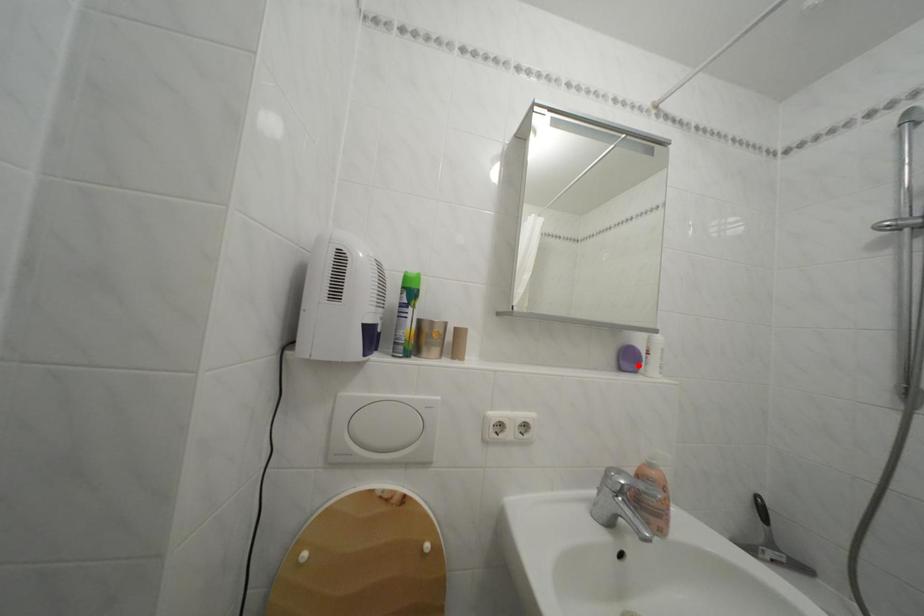
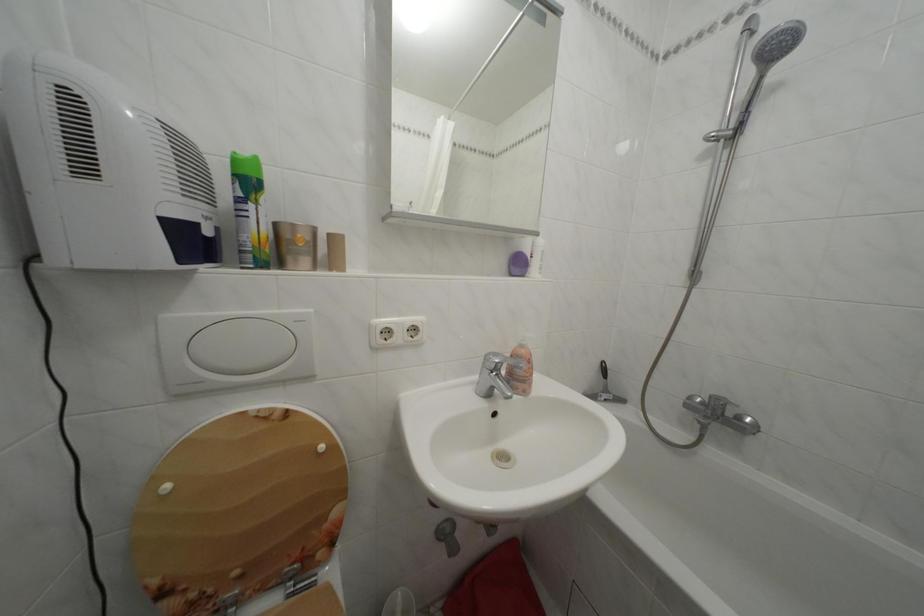
Find the pixel in the second image that matches the highlighted location in the first image.

(527, 270)